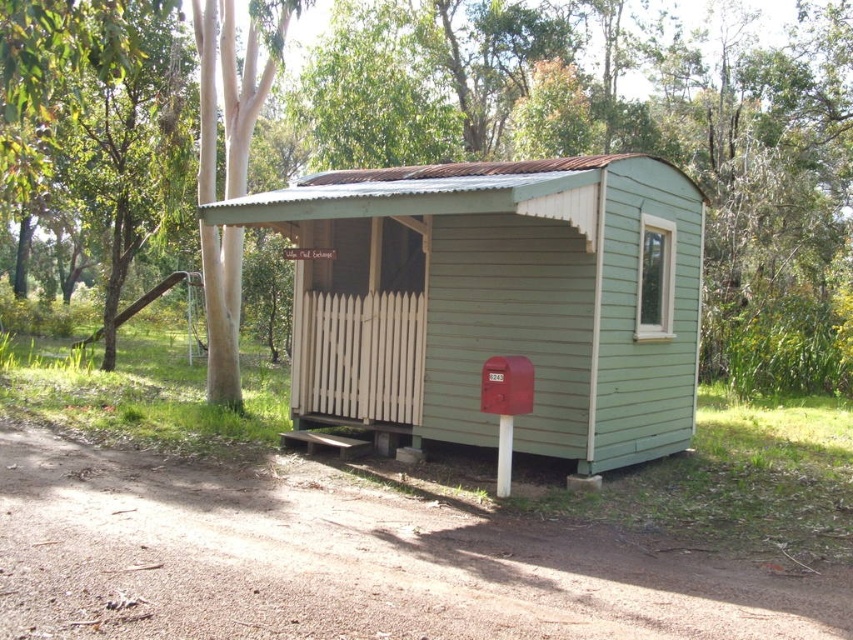
You are planning to build a new garden shed in your backyard. You want to place it where the green wood cabin at center currently stands. However, you need to ensure there is enough space between the new shed and the green wood tree at center to comply with local regulations. Based on the image, can you determine if the current spacing between them meets the requirement?

The green wood tree at center might be wider than green wood cabin at center, so it is uncertain if the current spacing between them meets the local regulations. You should measure the actual width of the tree and cabin to ensure compliance.